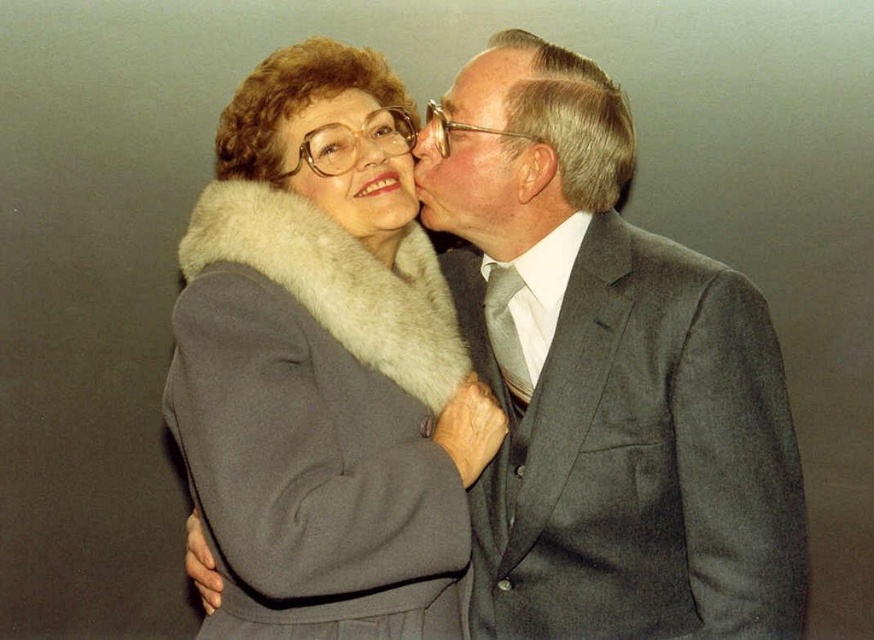
Is point (556, 620) more distant than point (480, 61)?

No, it is in front of (480, 61).

Who is more forward, [725,589] or [493,168]?

Point [725,589] is more forward.

You are a GUI agent. You are given a task and a screenshot of the screen. Output one action in this format:
    pyautogui.click(x=<x>, y=<y>)
    Task: Click on the gray wool suit at center
    The height and width of the screenshot is (640, 874).
    Given the screenshot: What is the action you would take?
    pyautogui.click(x=607, y=378)

Which is behind, point (522, 364) or point (390, 168)?

Point (522, 364)

Is gray wool suit at center closer to the viewer compared to matte gray fur coat at upper center?

That is True.

Which is behind, point (768, 637) or point (349, 214)?

The point (349, 214) is behind.

Locate an element on the screen. The width and height of the screenshot is (874, 640). gray wool suit at center is located at coordinates (607, 378).

Is gray wool coat with fur collar at center shorter than matte gray suit at center?

No, gray wool coat with fur collar at center is not shorter than matte gray suit at center.

Can you confirm if gray wool coat with fur collar at center is taller than matte gray suit at center?

Indeed, gray wool coat with fur collar at center has a greater height compared to matte gray suit at center.

Which is in front, point (247, 602) or point (467, 177)?

Point (247, 602)

Locate an element on the screen. This screenshot has height=640, width=874. gray wool coat with fur collar at center is located at coordinates (324, 365).